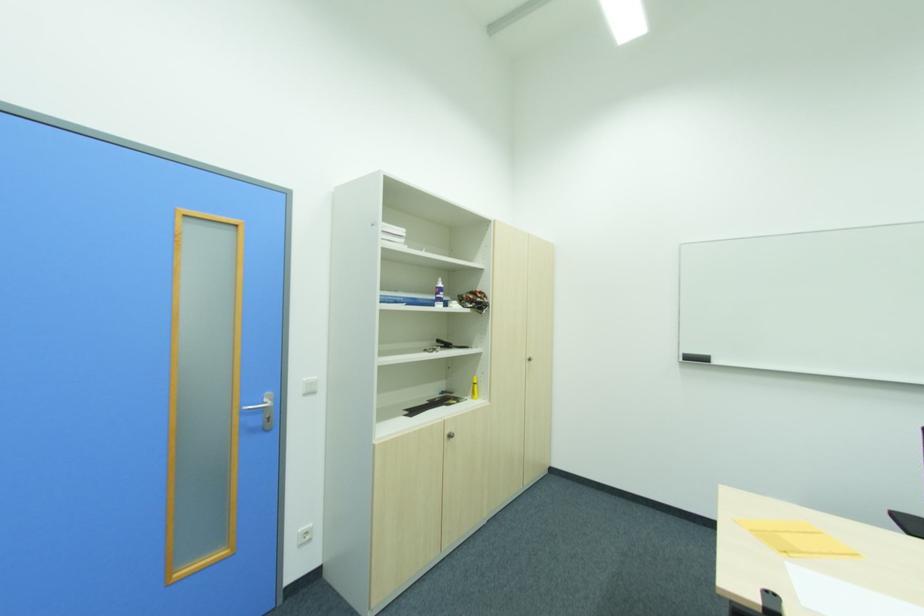
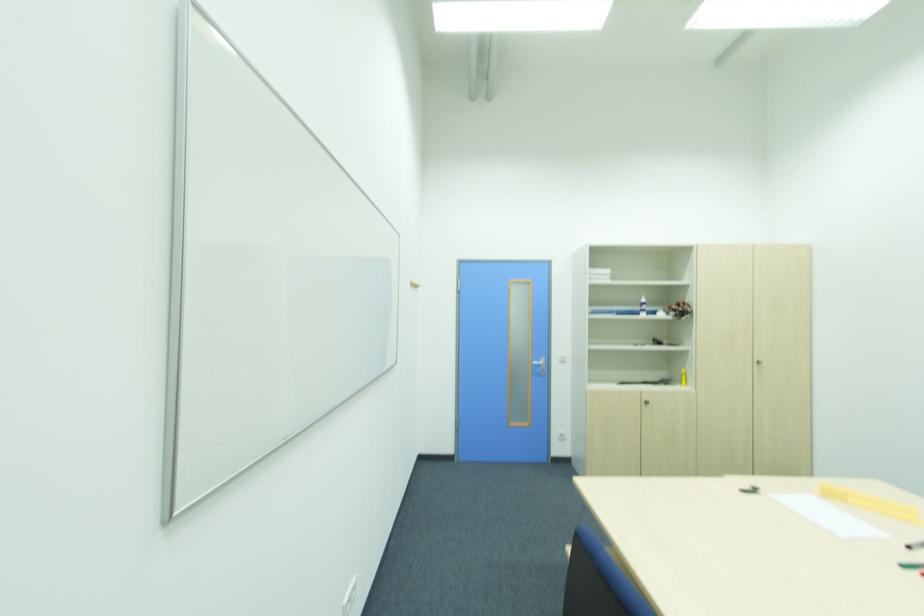
Where in the second image is the point corresponding to (x=440, y=284) from the first image?

(643, 301)